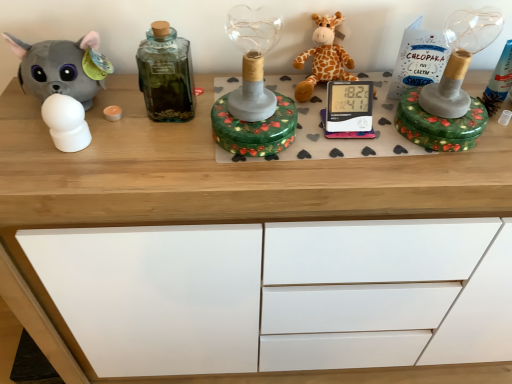
Question: Choose the correct answer: Is matte gray plush toy at left, the 2th toy when ordered from right to left, inside green glass bottle at center or outside it?

Choices:
 (A) outside
 (B) inside

Answer: (A)

Question: Considering the positions of matte gray plush toy at left, the 2th toy when ordered from right to left, and green glass bottle at center in the image, is matte gray plush toy at left, the 2th toy when ordered from right to left, bigger or smaller than green glass bottle at center?

Choices:
 (A) big
 (B) small

Answer: (A)

Question: Considering the real-world distances, which object is farthest from the green glass bottle at center?

Choices:
 (A) orange plush giraffe at center, acting as the second toy starting from the left
 (B) matte gray plush toy at left, the 1th toy when ordered from left to right

Answer: (A)

Question: Which object is the farthest from the green glass bottle at center?

Choices:
 (A) orange plush giraffe at center, acting as the second toy starting from the left
 (B) matte gray plush toy at left, the 2th toy when ordered from right to left

Answer: (A)